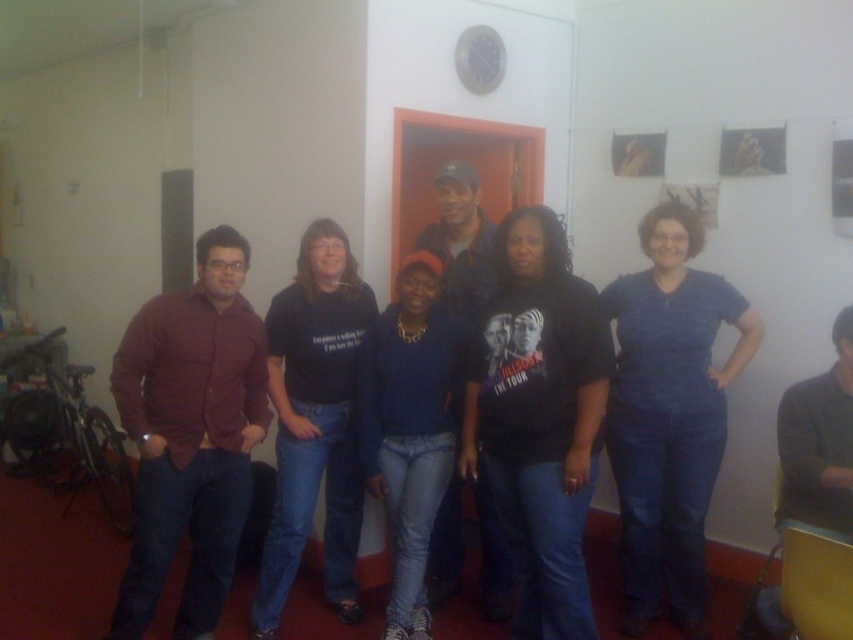
You are a photographer trying to adjust the lighting between the blue denim jeans at center and the black cotton shirt at center. Since they are 1.20 meters apart, how much space do you need to cover between them to ensure even lighting?

The space between the blue denim jeans at center and the black cotton shirt at center is 1.20 meters, so you need to cover at least 1.20 meters to ensure even lighting.

You are a photographer trying to adjust the lighting for a group photo. You notice the matte burgundy shirt at left and the black cotton shirt at center. Which shirt is closer to the camera?

The matte burgundy shirt at left is closer to the camera because it is in front of the black cotton shirt at center.

In the scene shown: You are a photographer adjusting the camera settings to ensure all clothing items are in focus. The black cotton shirt at center and denim jeans at center are both in the frame. Which clothing item should you focus on first to ensure proper focus given their positions?

The black cotton shirt at center is much taller than the denim jeans at center, so focusing on the black cotton shirt at center first would ensure proper focus since it is closer to the camera.